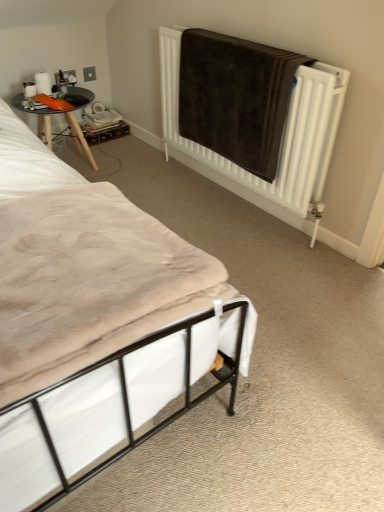
Question: Would you say wooden table at left contains brown towel at upper right?

Choices:
 (A) yes
 (B) no

Answer: (B)

Question: Does wooden table at left have a lesser height compared to brown towel at upper right?

Choices:
 (A) yes
 (B) no

Answer: (A)

Question: Does wooden table at left have a larger size compared to brown towel at upper right?

Choices:
 (A) yes
 (B) no

Answer: (B)

Question: Can you confirm if wooden table at left is wider than brown towel at upper right?

Choices:
 (A) no
 (B) yes

Answer: (B)

Question: From a real-world perspective, does wooden table at left sit lower than brown towel at upper right?

Choices:
 (A) no
 (B) yes

Answer: (B)

Question: Is wooden table at left thinner than brown towel at upper right?

Choices:
 (A) yes
 (B) no

Answer: (B)

Question: Considering the relative positions of brown towel at upper right and white fabric bed at lower left in the image provided, is brown towel at upper right to the left of white fabric bed at lower left from the viewer's perspective?

Choices:
 (A) no
 (B) yes

Answer: (A)

Question: From a real-world perspective, is brown towel at upper right positioned over white fabric bed at lower left based on gravity?

Choices:
 (A) no
 (B) yes

Answer: (B)

Question: Is brown towel at upper right positioned beyond the bounds of white fabric bed at lower left?

Choices:
 (A) yes
 (B) no

Answer: (A)

Question: Would you consider brown towel at upper right to be distant from white fabric bed at lower left?

Choices:
 (A) yes
 (B) no

Answer: (A)

Question: Can you confirm if brown towel at upper right is shorter than white fabric bed at lower left?

Choices:
 (A) yes
 (B) no

Answer: (B)

Question: Considering the relative sizes of brown towel at upper right and white fabric bed at lower left in the image provided, is brown towel at upper right taller than white fabric bed at lower left?

Choices:
 (A) no
 (B) yes

Answer: (B)

Question: Can you confirm if wooden table at left is thinner than white fabric bed at lower left?

Choices:
 (A) no
 (B) yes

Answer: (B)